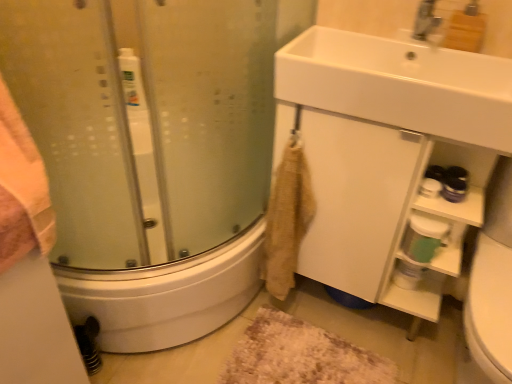
Question: Does green plastic container at lower right come in front of white matte cabinet at lower right?

Choices:
 (A) no
 (B) yes

Answer: (A)

Question: Is green plastic container at lower right at the left side of white matte cabinet at lower right?

Choices:
 (A) no
 (B) yes

Answer: (A)

Question: Considering the relative sizes of green plastic container at lower right and white matte cabinet at lower right in the image provided, is green plastic container at lower right thinner than white matte cabinet at lower right?

Choices:
 (A) no
 (B) yes

Answer: (B)

Question: Is green plastic container at lower right facing away from white matte cabinet at lower right?

Choices:
 (A) no
 (B) yes

Answer: (B)

Question: Does green plastic container at lower right touch white matte cabinet at lower right?

Choices:
 (A) yes
 (B) no

Answer: (B)

Question: Considering the positions of green plastic container at lower right and transparent glass shower door at left in the image, is green plastic container at lower right wider or thinner than transparent glass shower door at left?

Choices:
 (A) thin
 (B) wide

Answer: (A)

Question: Is green plastic container at lower right inside or outside of transparent glass shower door at left?

Choices:
 (A) inside
 (B) outside

Answer: (B)

Question: Would you say green plastic container at lower right is to the left or to the right of transparent glass shower door at left in the picture?

Choices:
 (A) right
 (B) left

Answer: (A)

Question: In the image, is green plastic container at lower right positioned in front of or behind transparent glass shower door at left?

Choices:
 (A) behind
 (B) front

Answer: (A)

Question: From the image's perspective, is white glossy sink at upper right above or below green plastic container at lower right?

Choices:
 (A) above
 (B) below

Answer: (A)

Question: Is white glossy sink at upper right spatially inside green plastic container at lower right, or outside of it?

Choices:
 (A) outside
 (B) inside

Answer: (A)

Question: Considering the positions of white glossy sink at upper right and green plastic container at lower right in the image, is white glossy sink at upper right taller or shorter than green plastic container at lower right?

Choices:
 (A) tall
 (B) short

Answer: (A)

Question: Considering the positions of point 463,74 and point 404,244, is point 463,74 closer or farther from the camera than point 404,244?

Choices:
 (A) closer
 (B) farther

Answer: (A)

Question: In terms of height, does beige textured towel at lower center look taller or shorter compared to brown shaggy bath mat at lower center?

Choices:
 (A) short
 (B) tall

Answer: (B)

Question: Considering their positions, is beige textured towel at lower center located in front of or behind brown shaggy bath mat at lower center?

Choices:
 (A) behind
 (B) front

Answer: (B)